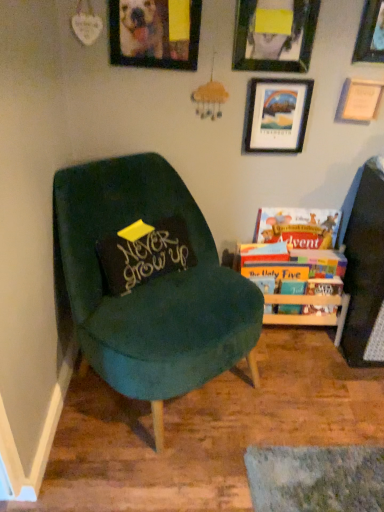
Where is `free location in front of hardcover books at right, which is the first book from bottom to top`? Image resolution: width=384 pixels, height=512 pixels. free location in front of hardcover books at right, which is the first book from bottom to top is located at coordinates (307, 391).